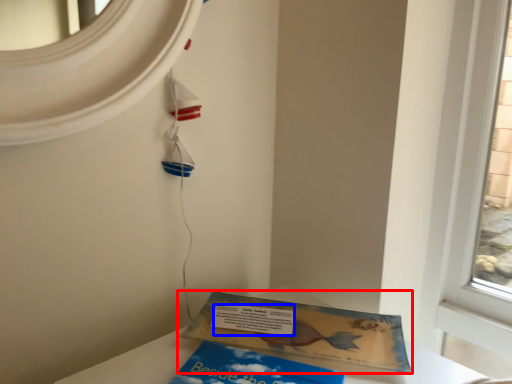
Question: Which object appears closest to the camera in this image, book (highlighted by a red box) or writing (highlighted by a blue box)?

Choices:
 (A) book
 (B) writing

Answer: (A)